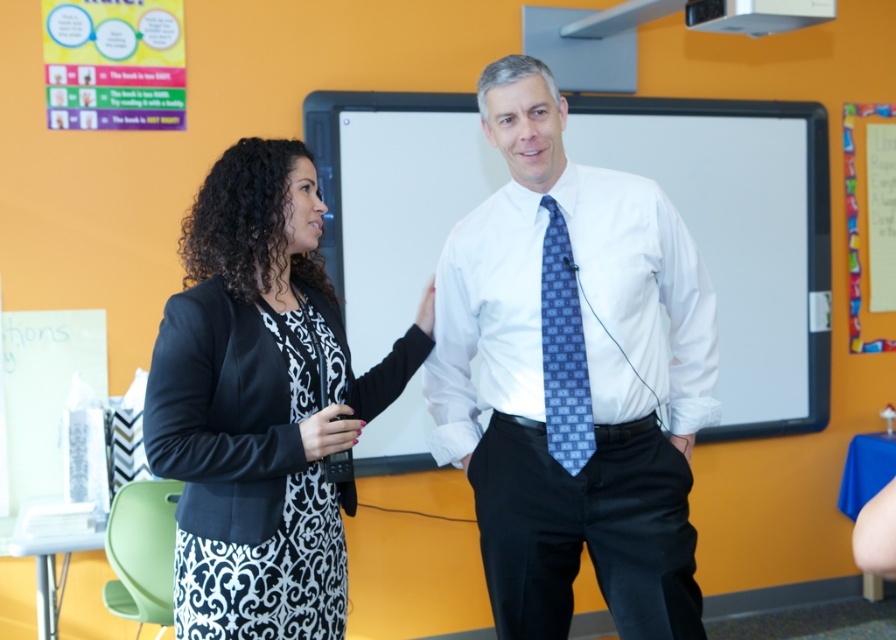
Question: Among these points, which one is farthest from the camera?

Choices:
 (A) (461, 209)
 (B) (582, 372)
 (C) (293, 547)
 (D) (630, 417)

Answer: (A)

Question: Estimate the real-world distances between objects in this image. Which object is farther from the blue patterned tie at center?

Choices:
 (A) whiteboard at center
 (B) white smooth shirt at center

Answer: (A)

Question: Does white smooth shirt at center appear over whiteboard at center?

Choices:
 (A) no
 (B) yes

Answer: (A)

Question: Based on their relative distances, which object is farther from the white smooth shirt at center?

Choices:
 (A) black matte blazer at center
 (B) blue patterned tie at center

Answer: (A)

Question: Is whiteboard at center above black matte blazer at center?

Choices:
 (A) no
 (B) yes

Answer: (B)

Question: Does white smooth shirt at center have a greater width compared to black matte blazer at center?

Choices:
 (A) yes
 (B) no

Answer: (A)